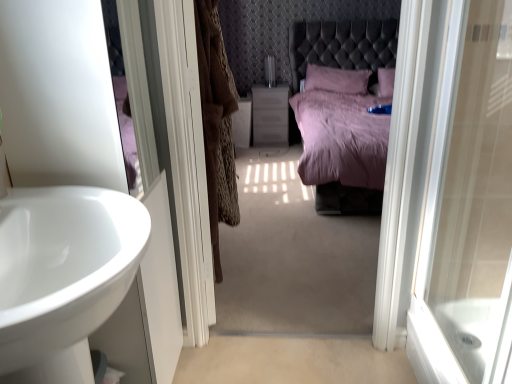
Question: Should I look upward or downward to see brown fur coat at center?

Choices:
 (A) down
 (B) up

Answer: (B)

Question: Does white glossy screen door at center have a greater height compared to brown fur coat at center?

Choices:
 (A) yes
 (B) no

Answer: (A)

Question: Is white glossy screen door at center with brown fur coat at center?

Choices:
 (A) yes
 (B) no

Answer: (B)

Question: Would you say white glossy screen door at center is outside brown fur coat at center?

Choices:
 (A) yes
 (B) no

Answer: (A)

Question: Considering the relative sizes of white glossy screen door at center and brown fur coat at center in the image provided, is white glossy screen door at center shorter than brown fur coat at center?

Choices:
 (A) no
 (B) yes

Answer: (A)

Question: Can you confirm if white glossy screen door at center is positioned to the right of brown fur coat at center?

Choices:
 (A) yes
 (B) no

Answer: (B)

Question: Is white glossy screen door at center far from brown fur coat at center?

Choices:
 (A) yes
 (B) no

Answer: (B)

Question: Is white glossy sink at left outside of white glossy screen door at center?

Choices:
 (A) no
 (B) yes

Answer: (B)

Question: Is white glossy sink at left positioned with its back to white glossy screen door at center?

Choices:
 (A) yes
 (B) no

Answer: (B)

Question: From the image's perspective, is white glossy sink at left beneath white glossy screen door at center?

Choices:
 (A) no
 (B) yes

Answer: (B)

Question: From the image's perspective, is white glossy sink at left above white glossy screen door at center?

Choices:
 (A) yes
 (B) no

Answer: (B)

Question: Can you confirm if white glossy sink at left is positioned to the right of white glossy screen door at center?

Choices:
 (A) no
 (B) yes

Answer: (A)

Question: Is there a large distance between white glossy sink at left and white glossy screen door at center?

Choices:
 (A) yes
 (B) no

Answer: (B)

Question: Can white glossy door at right be found inside matte plastic vanity at center?

Choices:
 (A) no
 (B) yes

Answer: (A)